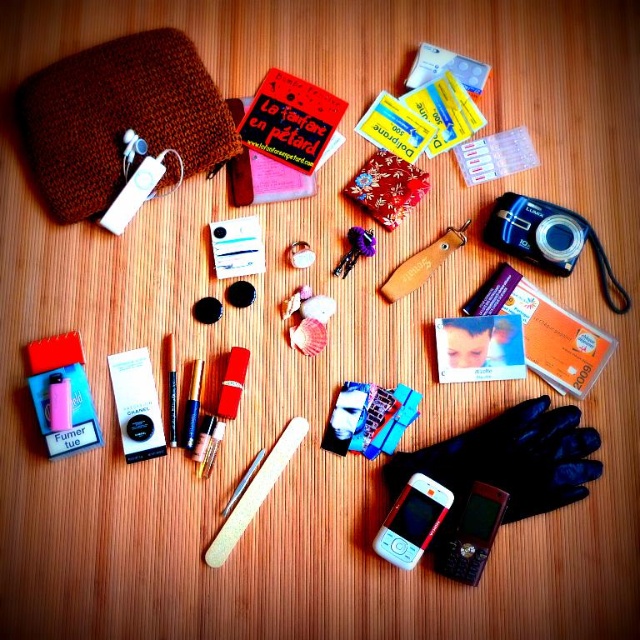
Question: Is matte white phone at bottom center below wooden nail file at center?

Choices:
 (A) no
 (B) yes

Answer: (B)

Question: Is black plastic phone at center above matte white phone at bottom center?

Choices:
 (A) yes
 (B) no

Answer: (B)

Question: Which of the following is the farthest from the observer?

Choices:
 (A) wooden comb at center
 (B) brown knitted pouch at upper left
 (C) matte black cigarette case at center-left

Answer: (A)

Question: Which object is farther from the camera taking this photo?

Choices:
 (A) wooden nail file at center
 (B) purple fabric keychain at center

Answer: (B)

Question: Which of the following is the closest to the observer?

Choices:
 (A) (416, 564)
 (B) (177, 176)
 (C) (285, 452)
 (D) (129, 432)

Answer: (D)

Question: Is matte white phone at bottom center above wooden nail file at center?

Choices:
 (A) yes
 (B) no

Answer: (B)